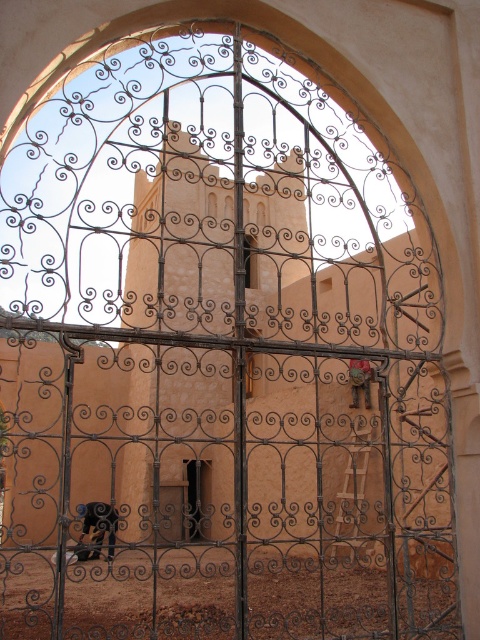
You are a delivery person trying to enter through the gate. You see a smooth wood door at center and a dark brown wrought iron door at center. Which door should you use if you need to carry a large package?

You should use the dark brown wrought iron door at center because it is larger than the smooth wood door at center, allowing more space to carry a large package through.

Based on the photo, you are standing in front of a traditional building with two doors. The doors are the smooth wood door at center and the dark brown wrought iron door at center. Which door is positioned to the right side?

The smooth wood door at center is positioned to the right of the dark brown wrought iron door at center.

You are a visitor approaching the entrance of a historical building. You see a smooth wood door at center and a dark brown wrought iron door at center. Which door is positioned lower in the image?

The smooth wood door at center is located below the dark brown wrought iron door at center, so it is positioned lower in the image.